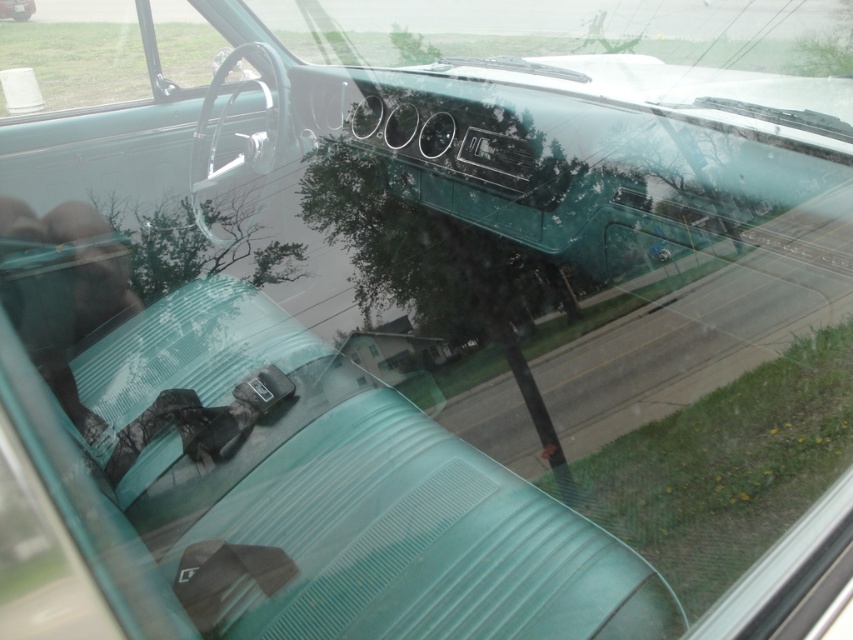
Is clear glass windshield at upper center above transparent glass window at center?

Indeed, clear glass windshield at upper center is positioned over transparent glass window at center.

Is the position of clear glass windshield at upper center more distant than that of transparent glass window at center?

No, clear glass windshield at upper center is in front of transparent glass window at center.

Does point (535, 33) come in front of point (374, 356)?

No, it is not.

Identify the location of clear glass windshield at upper center. point(601,44).

From the picture: Does clear glass window at upper left come behind transparent glass window at center?

Yes, clear glass window at upper left is behind transparent glass window at center.

Who is taller, clear glass window at upper left or transparent glass window at center?

clear glass window at upper left is taller.

What do you see at coordinates (78, 51) in the screenshot?
I see `clear glass window at upper left` at bounding box center [78, 51].

The image size is (853, 640). What are the coordinates of `clear glass window at upper left` in the screenshot? It's located at (78, 51).

Describe the element at coordinates (601, 44) in the screenshot. I see `clear glass windshield at upper center` at that location.

Who is positioned more to the right, clear glass windshield at upper center or clear glass window at upper left?

clear glass windshield at upper center is more to the right.

Is point (664, 60) positioned behind point (86, 6)?

No, (664, 60) is in front of (86, 6).

Where is `clear glass windshield at upper center`? Image resolution: width=853 pixels, height=640 pixels. clear glass windshield at upper center is located at coordinates (601, 44).